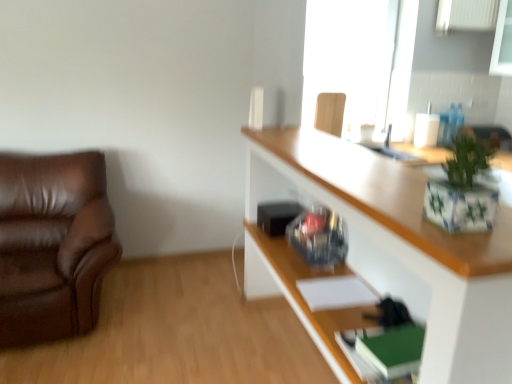
Question: Visually, is transparent glass window at upper center positioned to the left or to the right of wooden chair at upper right, which ranks as the 2th chair in front-to-back order?

Choices:
 (A) right
 (B) left

Answer: (A)

Question: Looking at the image, does transparent glass window at upper center seem bigger or smaller compared to wooden chair at upper right, which ranks as the 2th chair in bottom-to-top order?

Choices:
 (A) small
 (B) big

Answer: (B)

Question: Considering the real-world distances, which object is farthest from the white glossy cabinet at upper right?

Choices:
 (A) green ceramic pot at upper right
 (B) wooden chair at upper right, which ranks as the 1th chair in top-to-bottom order
 (C) transparent glass window at upper center
 (D) brown leather couch at left, which is the 2th chair from top to bottom

Answer: (C)

Question: Which is farther from the transparent glass window at upper center?

Choices:
 (A) wooden chair at upper right, the first chair viewed from the back
 (B) green ceramic pot at upper right
 (C) brown leather couch at left, arranged as the first chair when viewed from the front
 (D) white glossy cabinet at upper right

Answer: (B)